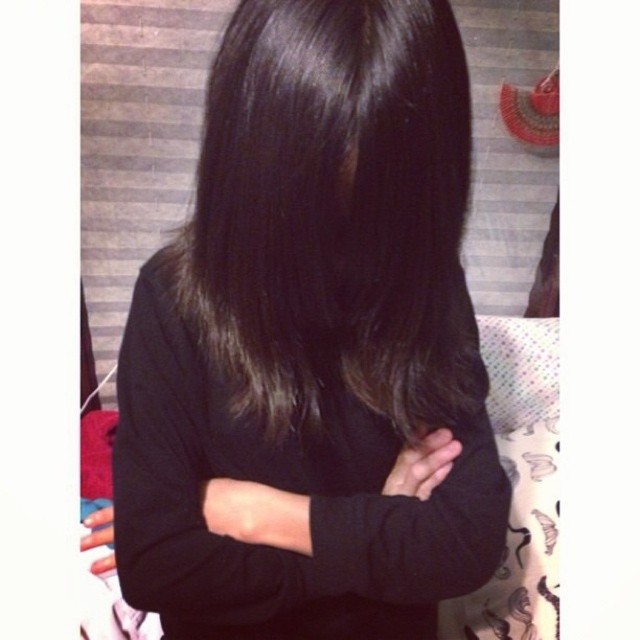
Question: Which point appears farthest from the camera in this image?

Choices:
 (A) (433, 10)
 (B) (333, 611)

Answer: (B)

Question: Does shiny dark brown hair at center have a larger size compared to black matte sweater at center?

Choices:
 (A) yes
 (B) no

Answer: (B)

Question: Can you confirm if shiny dark brown hair at center is wider than black matte sweater at center?

Choices:
 (A) no
 (B) yes

Answer: (A)

Question: Which object is closer to the camera taking this photo?

Choices:
 (A) black matte sweater at center
 (B) shiny dark brown hair at center

Answer: (B)

Question: Is shiny dark brown hair at center wider than black matte sweater at center?

Choices:
 (A) no
 (B) yes

Answer: (A)